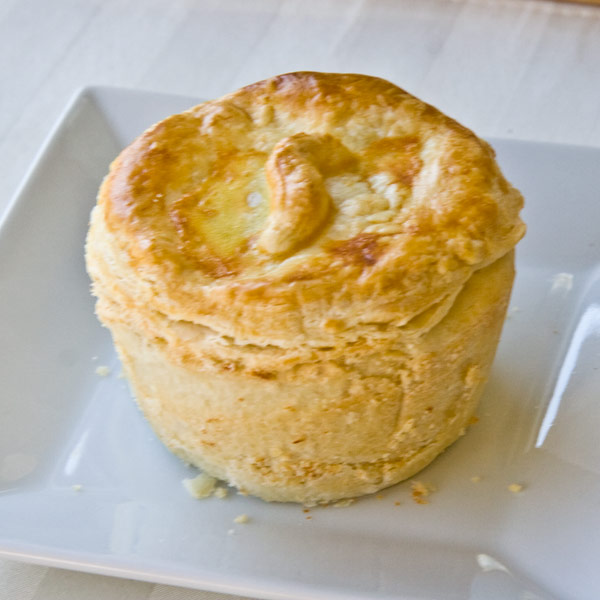
Locate an element on the screen. square shaped white ceramic plate is located at coordinates (106, 459).